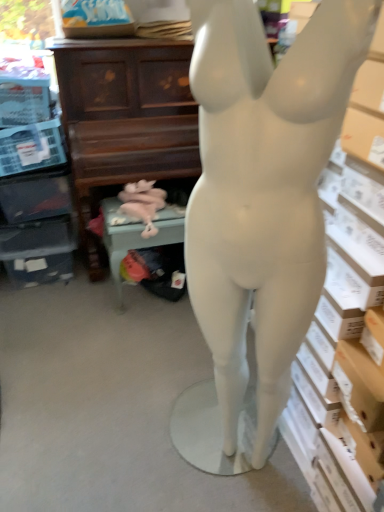
Question: Considering the relative positions of pink fabric stuffed animal at lower center and green fabric chair at lower center in the image provided, is pink fabric stuffed animal at lower center to the left of green fabric chair at lower center from the viewer's perspective?

Choices:
 (A) no
 (B) yes

Answer: (B)

Question: Is pink fabric stuffed animal at lower center facing towards green fabric chair at lower center?

Choices:
 (A) yes
 (B) no

Answer: (A)

Question: Considering the relative sizes of pink fabric stuffed animal at lower center and green fabric chair at lower center in the image provided, is pink fabric stuffed animal at lower center wider than green fabric chair at lower center?

Choices:
 (A) no
 (B) yes

Answer: (A)

Question: Is green fabric chair at lower center at the back of pink fabric stuffed animal at lower center?

Choices:
 (A) no
 (B) yes

Answer: (B)

Question: From the image's perspective, is pink fabric stuffed animal at lower center below green fabric chair at lower center?

Choices:
 (A) no
 (B) yes

Answer: (A)

Question: Is pink fabric stuffed animal at lower center outside of green fabric chair at lower center?

Choices:
 (A) yes
 (B) no

Answer: (B)

Question: Is matte brown piano at upper center at the left side of matte white mannequin at center?

Choices:
 (A) yes
 (B) no

Answer: (A)

Question: Is matte brown piano at upper center aimed at matte white mannequin at center?

Choices:
 (A) yes
 (B) no

Answer: (A)

Question: Considering the relative sizes of matte brown piano at upper center and matte white mannequin at center in the image provided, is matte brown piano at upper center taller than matte white mannequin at center?

Choices:
 (A) yes
 (B) no

Answer: (B)

Question: Is matte brown piano at upper center further to the viewer compared to matte white mannequin at center?

Choices:
 (A) no
 (B) yes

Answer: (B)

Question: Does matte brown piano at upper center touch matte white mannequin at center?

Choices:
 (A) no
 (B) yes

Answer: (A)

Question: From a real-world perspective, is matte brown piano at upper center on matte white mannequin at center?

Choices:
 (A) yes
 (B) no

Answer: (B)

Question: Does matte brown piano at upper center have a lesser height compared to green fabric chair at lower center?

Choices:
 (A) yes
 (B) no

Answer: (B)